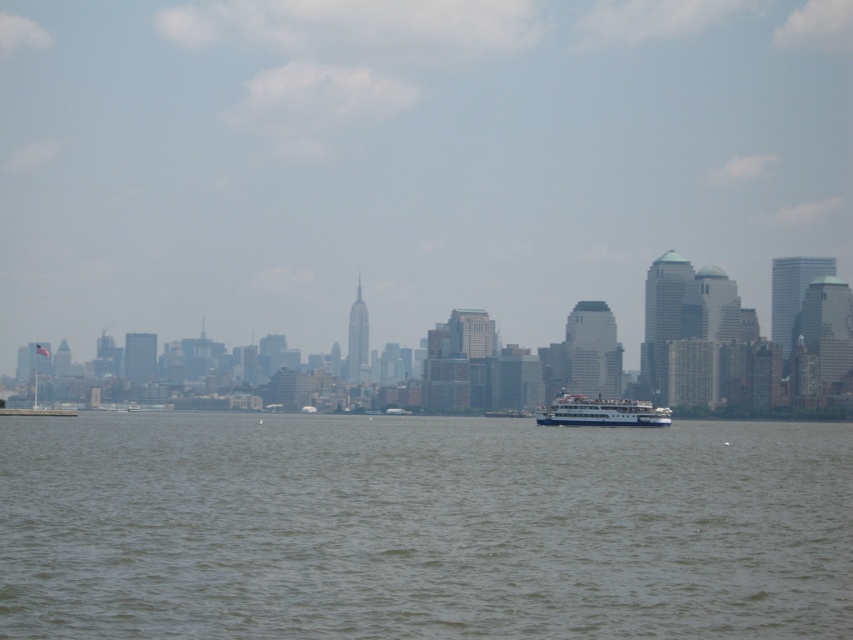
Question: Which object appears farthest from the camera in this image?

Choices:
 (A) brown water at center
 (B) white glossy ferry at center

Answer: (B)

Question: Does brown water at center appear on the right side of white glossy ferry at center?

Choices:
 (A) no
 (B) yes

Answer: (A)

Question: Can you confirm if brown water at center is positioned below white glossy ferry at center?

Choices:
 (A) no
 (B) yes

Answer: (B)

Question: Which object appears closest to the camera in this image?

Choices:
 (A) brown water at center
 (B) white glossy ferry at center

Answer: (A)

Question: Which of the following is the farthest from the observer?

Choices:
 (A) (0, 448)
 (B) (601, 410)

Answer: (A)

Question: In this image, where is brown water at center located relative to white glossy ferry at center?

Choices:
 (A) right
 (B) left

Answer: (B)